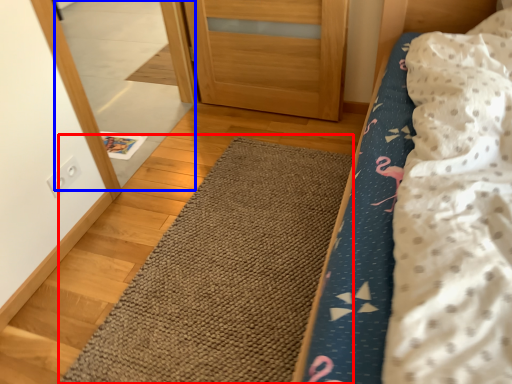
Question: Which object appears farthest to the camera in this image, doormat (highlighted by a red box) or mirror (highlighted by a blue box)?

Choices:
 (A) doormat
 (B) mirror

Answer: (B)